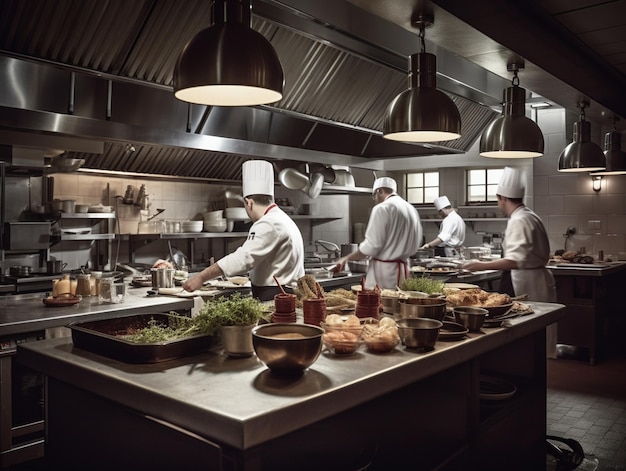
Find the location of `stack of bowls`. stack of bowls is located at coordinates (213, 216).